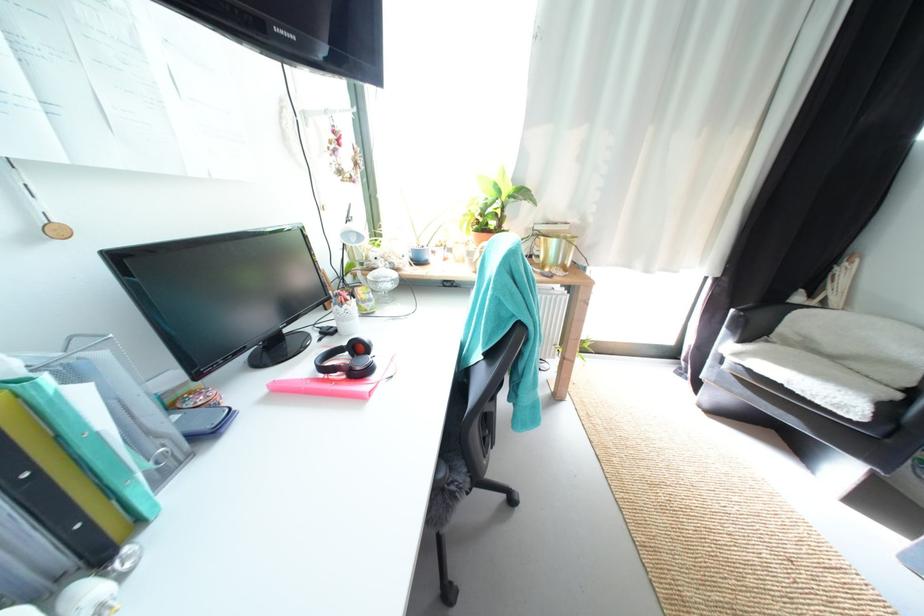
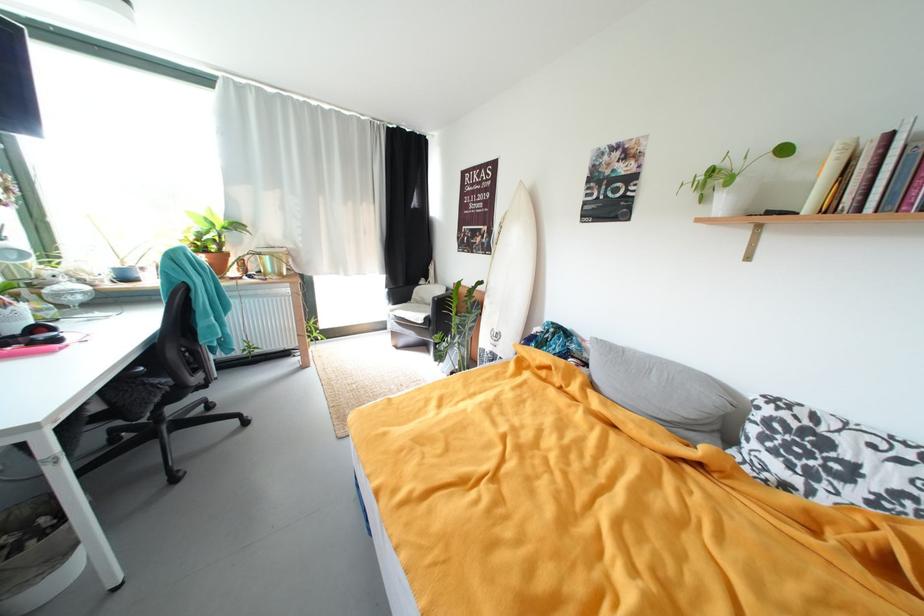
Where in the second image is the point corresponding to pixel 561 220 from the first image?

(281, 246)